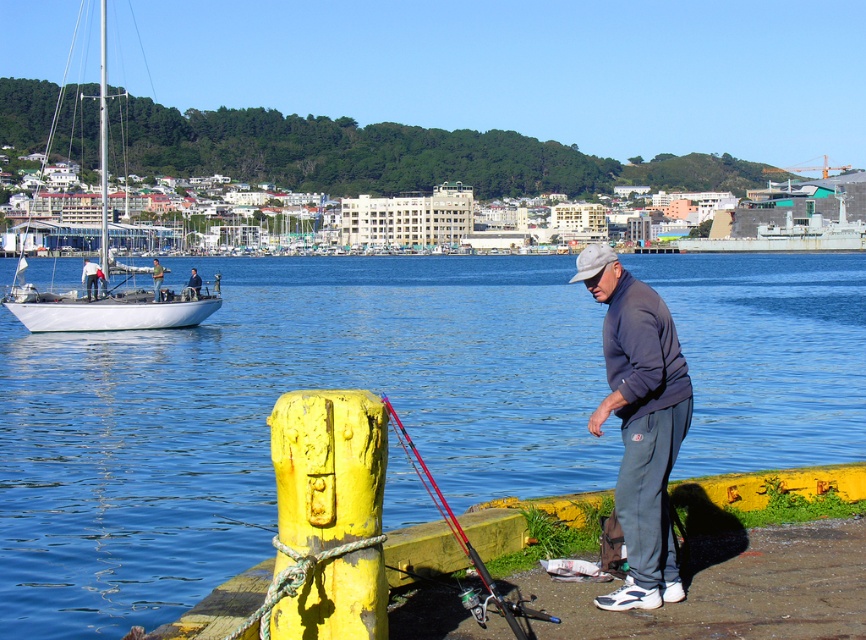
Does gray fleece jacket at lower right have a lesser width compared to matte gray jacket at lower right?

Indeed, gray fleece jacket at lower right has a lesser width compared to matte gray jacket at lower right.

Is gray fleece jacket at lower right further to camera compared to matte gray jacket at lower right?

No, it is in front of matte gray jacket at lower right.

Image resolution: width=866 pixels, height=640 pixels. Identify the location of gray fleece jacket at lower right. (638, 420).

Locate an element on the screen. This screenshot has height=640, width=866. gray fleece jacket at lower right is located at coordinates (638, 420).

Is matte black jacket at lower right taller than green fabric shirt at center?

Yes, matte black jacket at lower right is taller than green fabric shirt at center.

Does matte black jacket at lower right appear over green fabric shirt at center?

Yes.

This screenshot has width=866, height=640. Describe the element at coordinates (89, 276) in the screenshot. I see `matte black jacket at lower right` at that location.

Where is `matte black jacket at lower right`? The width and height of the screenshot is (866, 640). matte black jacket at lower right is located at coordinates (89, 276).

Does point (406, 445) lie in front of point (154, 291)?

Yes.

Where is `red fiberglass fishing pole at lower center`? The image size is (866, 640). red fiberglass fishing pole at lower center is located at coordinates (464, 541).